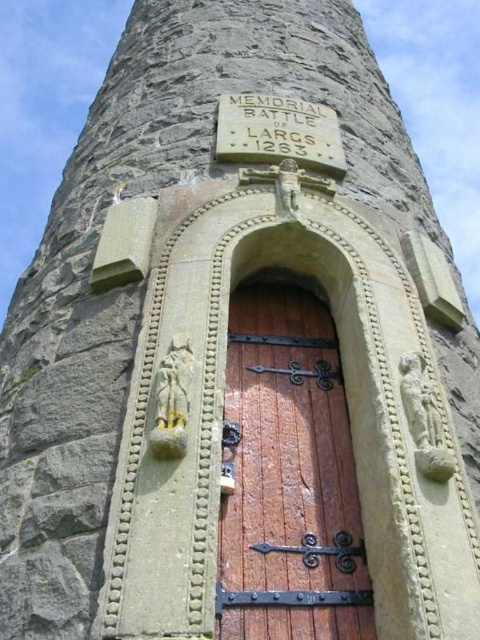
In the scene shown: You are a maintenance worker inspecting the stone tower. You notice the wooden door at center and the stone plaque at center. Which object is taller?

The wooden door at center is taller than the stone plaque at center.

You are a visitor approaching the stone tower and want to enter through the wooden door at center. Is the stone plaque at center blocking your path to the door?

The wooden door at center is in front of the stone plaque at center, so the stone plaque at center is behind the door and does not block your path.

You are standing in front of the stone tower and want to enter through the wooden door at center. However, you notice a stone plaque at center nearby. Which object is positioned to the right side from your perspective?

The wooden door at center is to the right of the stone plaque at center, so the wooden door at center is positioned to the right side from your perspective.